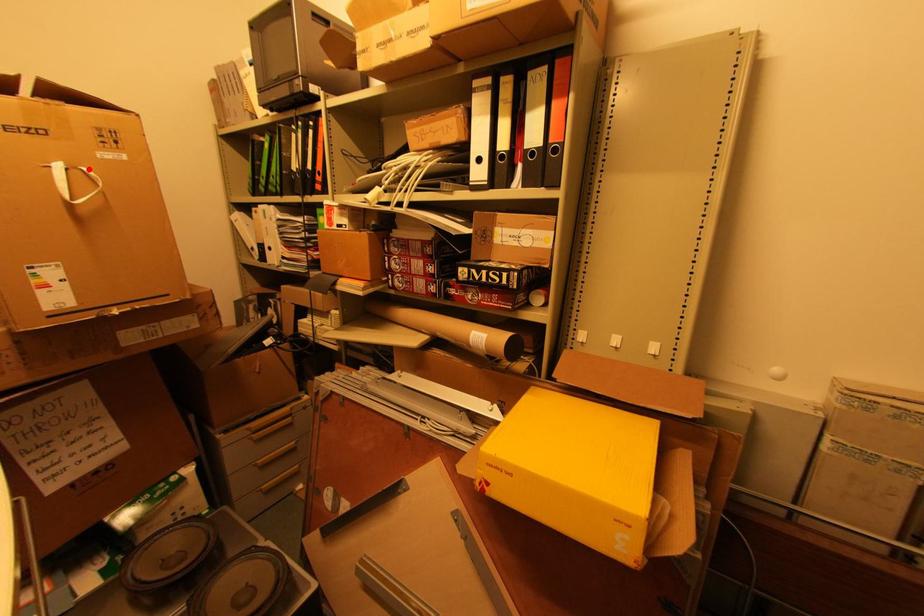
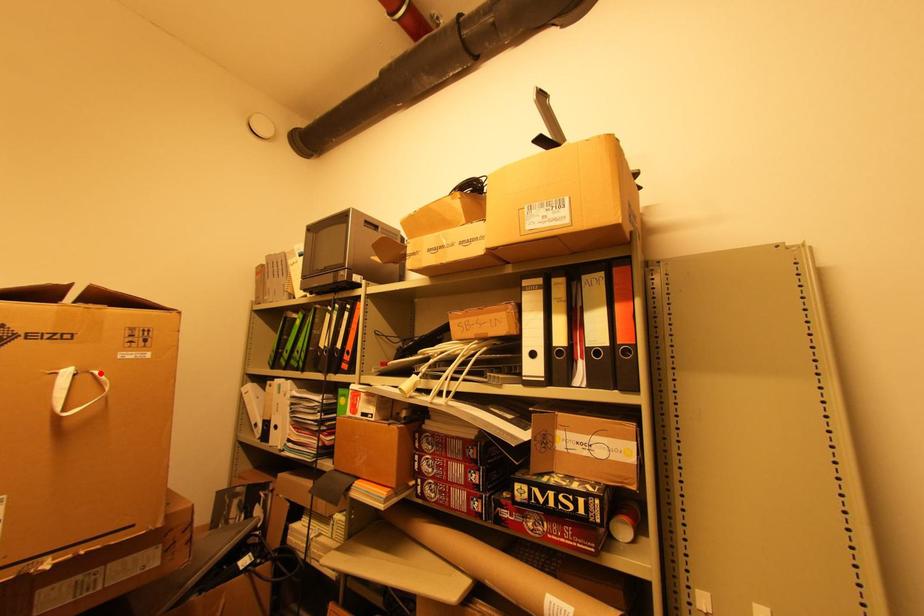
I am providing you with two images of the same scene from different viewpoints. A red point is marked on the first image and another point is marked on the second image. Is the red point in image1 aligned with the point shown in image2?

Yes